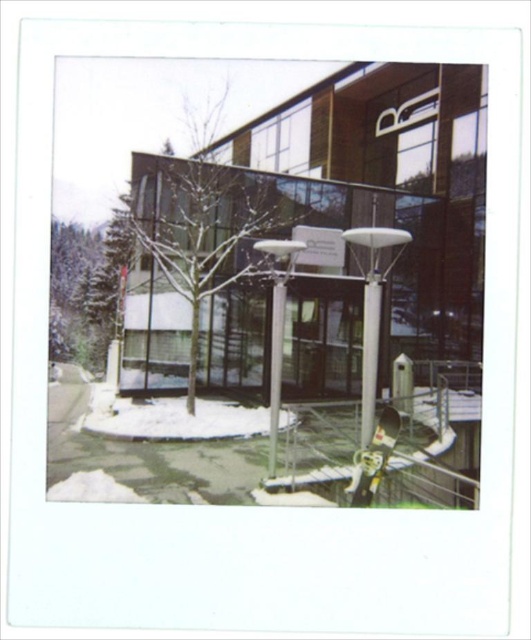
Between green textured tree at left and silver metallic lamp post at center, which one appears on the right side from the viewer's perspective?

silver metallic lamp post at center

Who is shorter, green textured tree at left or silver metallic lamp post at center?

Standing shorter between the two is silver metallic lamp post at center.

This screenshot has height=640, width=531. Find the location of `green textured tree at left`. green textured tree at left is located at coordinates (73, 292).

Where is `green textured tree at left`? The height and width of the screenshot is (640, 531). green textured tree at left is located at coordinates (73, 292).